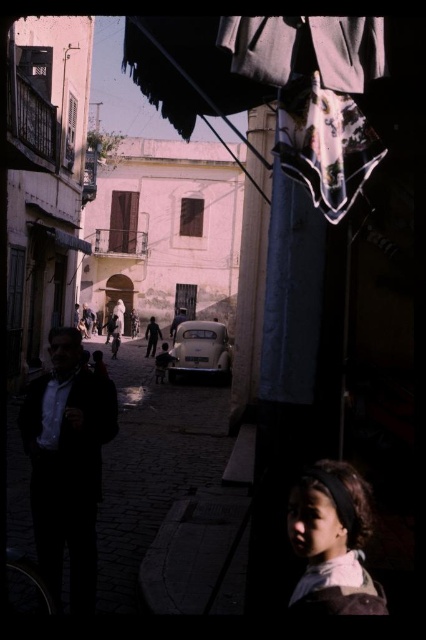
Question: Which of the following is the farthest from the observer?

Choices:
 (A) (170, 337)
 (B) (209, 332)

Answer: (A)

Question: Is white matte car at center bigger than dark brown hair at lower right?

Choices:
 (A) yes
 (B) no

Answer: (A)

Question: Where is dark matte suit at left located in relation to blue denim jacket at center in the image?

Choices:
 (A) right
 (B) left

Answer: (A)

Question: Which of the following is the farthest from the observer?

Choices:
 (A) dark matte suit at left
 (B) dark brown hair at lower right

Answer: (A)

Question: Can you confirm if white matte car at center is thinner than dark brown hair at lower right?

Choices:
 (A) yes
 (B) no

Answer: (B)

Question: Which point is farther to the camera?

Choices:
 (A) (359, 582)
 (B) (201, 371)
 (C) (184, 456)

Answer: (B)